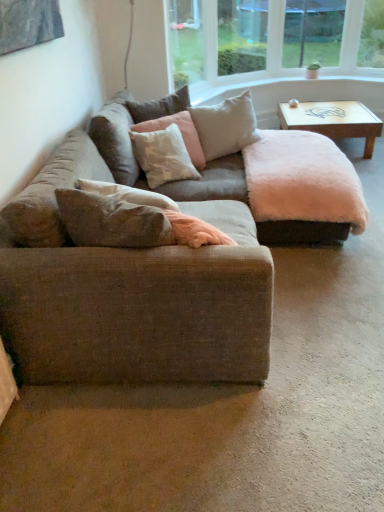
Question: Which direction should I rotate to face clear glass window screen at upper center, arranged as the 2th window screen when viewed from the left, — up or down?

Choices:
 (A) down
 (B) up

Answer: (B)

Question: Is textured beige couch at center with soft beige cushion at upper center, which ranks as the 4th pillow in front-to-back order?

Choices:
 (A) yes
 (B) no

Answer: (B)

Question: Can you confirm if textured beige couch at center is positioned to the left of soft beige cushion at upper center, marked as the first pillow in a back-to-front arrangement?

Choices:
 (A) yes
 (B) no

Answer: (B)

Question: Is textured beige couch at center surrounding soft beige cushion at upper center, marked as the first pillow in a back-to-front arrangement?

Choices:
 (A) no
 (B) yes

Answer: (B)

Question: From the image's perspective, is textured beige couch at center above soft beige cushion at upper center, marked as the first pillow in a back-to-front arrangement?

Choices:
 (A) no
 (B) yes

Answer: (A)

Question: Is textured beige couch at center in front of soft beige cushion at upper center, which ranks as the 4th pillow in front-to-back order?

Choices:
 (A) no
 (B) yes

Answer: (B)

Question: Can you confirm if textured beige couch at center is shorter than soft beige cushion at upper center, which ranks as the 4th pillow in front-to-back order?

Choices:
 (A) no
 (B) yes

Answer: (A)

Question: Does textured beige couch at center have a lesser height compared to soft beige cushion at upper center, which ranks as the 4th pillow in front-to-back order?

Choices:
 (A) yes
 (B) no

Answer: (B)

Question: From a real-world perspective, is textured beige couch at center positioned over soft beige cushion at upper center, marked as the first pillow in a back-to-front arrangement, based on gravity?

Choices:
 (A) no
 (B) yes

Answer: (A)

Question: From the image's perspective, is textured beige couch at center located above soft beige cushion at upper center, marked as the first pillow in a back-to-front arrangement?

Choices:
 (A) no
 (B) yes

Answer: (A)

Question: Considering the relative positions of textured beige couch at center and soft beige cushion at upper center, marked as the first pillow in a back-to-front arrangement, in the image provided, is textured beige couch at center to the left of soft beige cushion at upper center, marked as the first pillow in a back-to-front arrangement, from the viewer's perspective?

Choices:
 (A) yes
 (B) no

Answer: (B)

Question: Is textured beige couch at center positioned with its back to soft beige cushion at upper center, marked as the first pillow in a back-to-front arrangement?

Choices:
 (A) yes
 (B) no

Answer: (B)

Question: Can you confirm if textured beige couch at center is wider than soft beige cushion at upper center, marked as the first pillow in a back-to-front arrangement?

Choices:
 (A) yes
 (B) no

Answer: (A)

Question: Is soft beige cushion at upper center, marked as the first pillow in a back-to-front arrangement, positioned in front of textured beige couch at center?

Choices:
 (A) no
 (B) yes

Answer: (A)